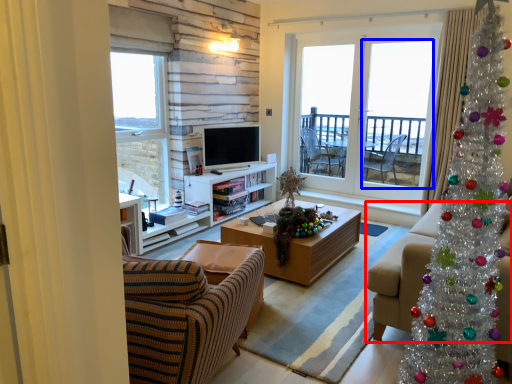
Question: Which object is further to the camera taking this photo, studio couch (highlighted by a red box) or screen door (highlighted by a blue box)?

Choices:
 (A) studio couch
 (B) screen door

Answer: (B)